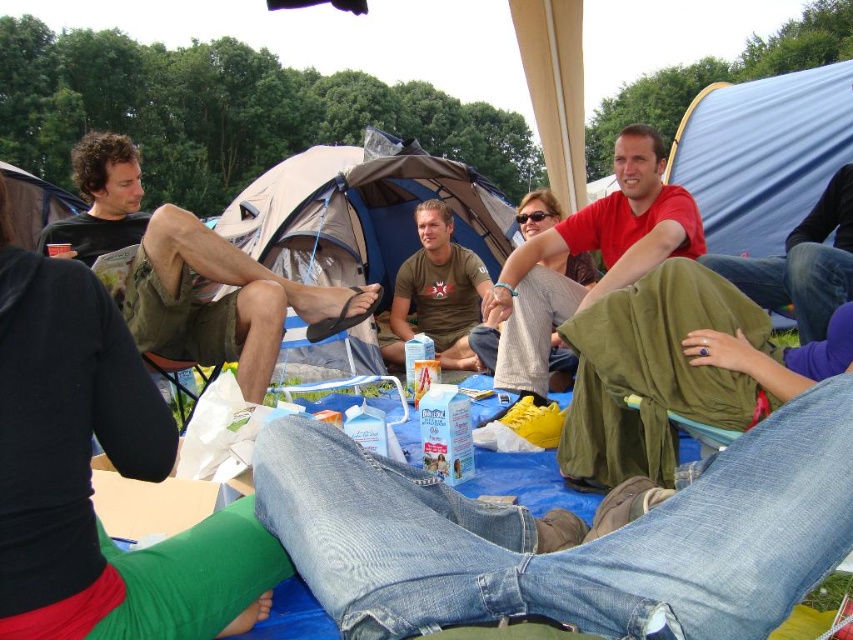
Is dark green shorts at left to the right of blue tarpaulin tent at center from the viewer's perspective?

No, dark green shorts at left is not to the right of blue tarpaulin tent at center.

In the scene shown: Does dark green shorts at left have a lesser height compared to blue tarpaulin tent at center?

Yes.

Who is more distant from viewer, (x=109, y=220) or (x=473, y=195)?

Positioned behind is point (x=473, y=195).

Where is `dark green shorts at left`? Image resolution: width=853 pixels, height=640 pixels. dark green shorts at left is located at coordinates (184, 273).

Based on the photo, who is shorter, blue tarpaulin tent at center or red matte shirt at upper center?

red matte shirt at upper center

Locate an element on the screen. The image size is (853, 640). blue tarpaulin tent at center is located at coordinates (361, 212).

Which is below, blue tarpaulin tent at center or green fabric blanket at lower right?

Positioned lower is green fabric blanket at lower right.

Does blue tarpaulin tent at center have a lesser width compared to green fabric blanket at lower right?

No.

Locate an element on the screen. blue tarpaulin tent at center is located at coordinates (361, 212).